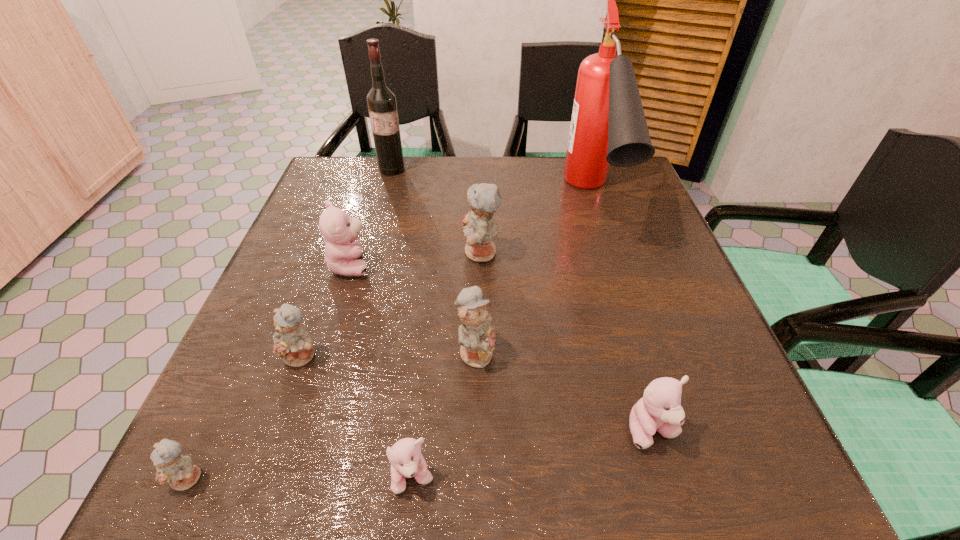
Find the location of `object that is at the near left corner`. object that is at the near left corner is located at coordinates (179, 471).

The image size is (960, 540). I want to click on object that is at the far right corner, so (x=608, y=126).

In order to click on object that is at the near right corner in this screenshot , I will do `click(659, 409)`.

At what (x,y) coordinates should I click in order to perform the action: click on vacant space at the far edge of the desktop. Please return your answer as a coordinate pair (x, y). The width and height of the screenshot is (960, 540). Looking at the image, I should click on (555, 171).

Locate an element on the screen. The image size is (960, 540). free location at the near edge is located at coordinates (425, 450).

Where is `vacant space at the left edge of the desktop`? The image size is (960, 540). vacant space at the left edge of the desktop is located at coordinates [274, 400].

The height and width of the screenshot is (540, 960). Identify the location of vacant space at the right edge. (674, 254).

In the image, there is a desktop. Find the location of `vacant space at the far left corner`. vacant space at the far left corner is located at coordinates (325, 166).

Locate an element on the screen. vacant point at the near right corner is located at coordinates pos(684,438).

You are a GUI agent. You are given a task and a screenshot of the screen. Output one action in this format:
    pyautogui.click(x=<x>, y=<y>)
    Task: Click on the empty location between the second biggest blue teddy bear and the nearest blue teddy bear
    
    Given the screenshot: What is the action you would take?
    pyautogui.click(x=332, y=415)